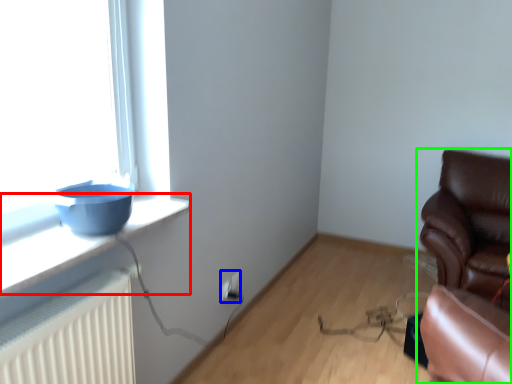
Question: Based on their relative distances, which object is nearer to window sill (highlighted by a red box)? Choose from electric outlet (highlighted by a blue box) and chair (highlighted by a green box).

Choices:
 (A) electric outlet
 (B) chair

Answer: (A)